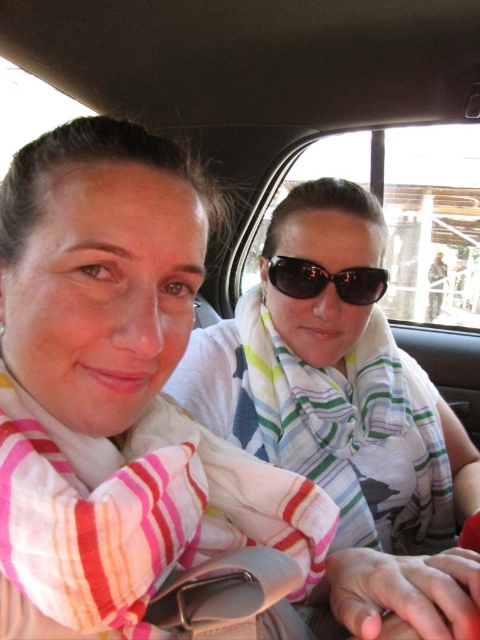
You are sitting in the driver seat of the car shown in the scene. You notice two points marked in the image. The first point is at coordinate point (354,540) and the second is at point (352,280). From your perspective in the driver seat, which point is located further back in the car?

Point (354,540) is behind point (352,280), so from the driver seat perspective, the point at (354,540) is further back in the car.

In the scene shown: You are a passenger in the car and want to hand a map to the driver. The map is currently on the passenger seat. Which object, the white striped scarf at center or the matte black sunglasses at center, is closer to you when reaching for the map?

The white striped scarf at center is closer to the viewer than matte black sunglasses at center, so the driver wearing the white striped scarf at center is closer to you when reaching for the map.

You are a passenger in the car and want to adjust your scarf. The point at coordinates [346,419] is located on your scarf. Which scarf is this point on?

The point at coordinates [346,419] is on the white striped scarf at center.